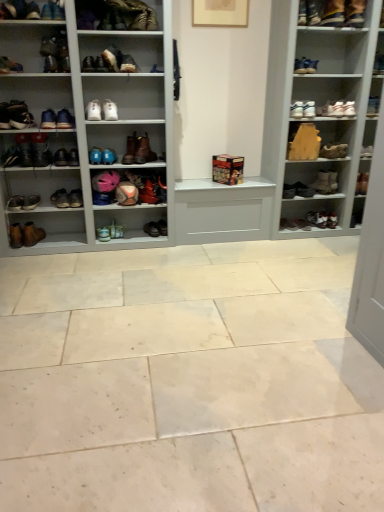
I want to click on empty space that is to the right of matte brown boot at center, the 12th shoe positioned from the right, so click(x=140, y=236).